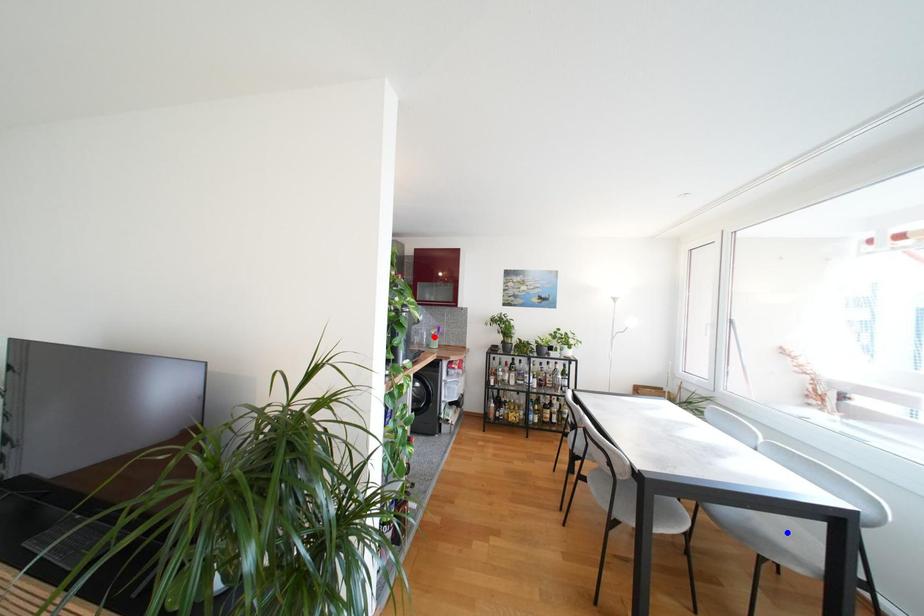
Question: Two points are marked on the image. Which point is closer to the camera?

Choices:
 (A) Blue point is closer.
 (B) Red point is closer.

Answer: (A)